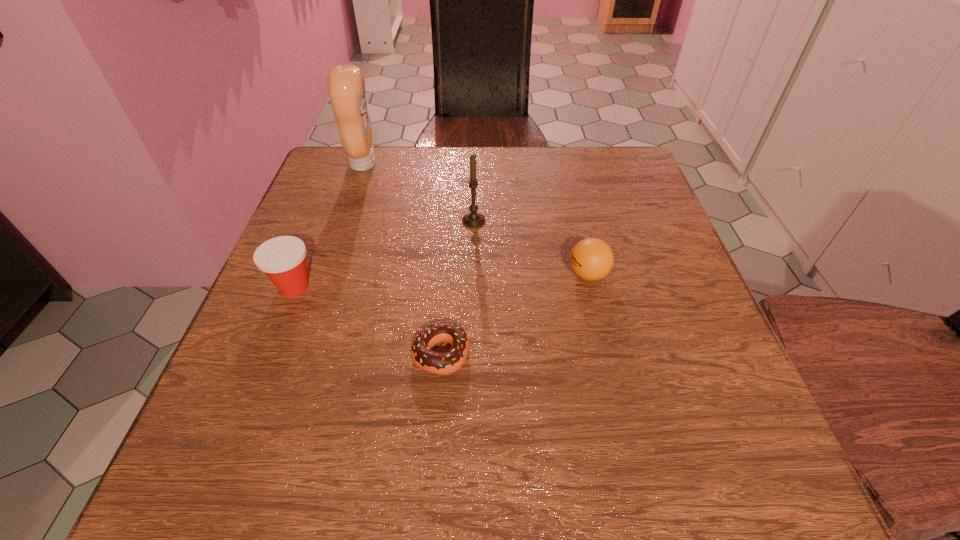
Identify the location of blank space located 0.400m on the back of the Dixie cup. (345, 161).

Where is `free location located on the side with brand of the rightmost object`? The height and width of the screenshot is (540, 960). free location located on the side with brand of the rightmost object is located at coordinates (541, 274).

The width and height of the screenshot is (960, 540). Find the location of `vacant space located 0.210m on the side with brand of the rightmost object`. vacant space located 0.210m on the side with brand of the rightmost object is located at coordinates (459, 274).

Locate an element on the screen. vacant region located 0.230m on the side with brand of the rightmost object is located at coordinates (448, 274).

Find the location of a particular element. vacant space located 0.190m on the right of the shortest object is located at coordinates (585, 354).

The image size is (960, 540). What are the coordinates of `object that is at the far edge` in the screenshot? It's located at (346, 85).

Identify the location of condiment that is at the left edge. (346, 85).

Image resolution: width=960 pixels, height=540 pixels. I want to click on Dixie cup that is at the left edge, so click(282, 259).

Find the location of `object located in the right edge section of the desktop`. object located in the right edge section of the desktop is located at coordinates (591, 259).

This screenshot has height=540, width=960. Identify the location of object situated at the far left corner. (346, 85).